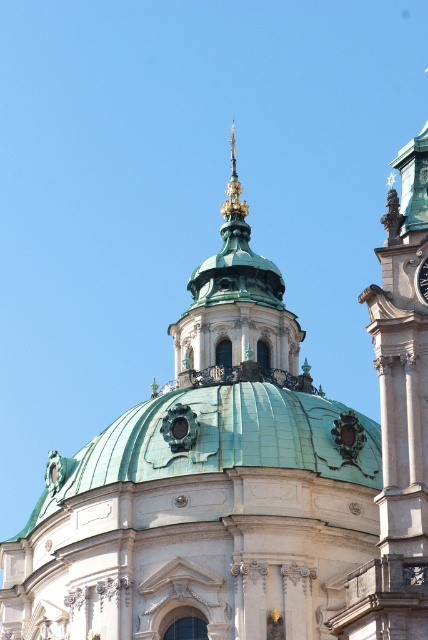
You are an architect examining the dome of this grand structure. You notice two points marked on the dome surface at coordinates point (77, 493) and point (422, 260). Which of these points is closer to you as you stand facing the dome?

Point (77, 493) is closer to you than point (422, 260) because it is further to the viewer.

You are an architect designing a scale model of this structure. The metallic silver clock at upper center must be placed on the model. Given that the green copper dome at center is wider than the clock, where should the clock be positioned relative to the dome to maintain proportional accuracy?

The metallic silver clock at upper center should be positioned above the green copper dome at center since the dome is wider than the clock, allowing the clock to be placed proportionally in a higher position while maintaining scale.

You are standing at the base of the grand structure and looking up at the dome. There is a point marked at coordinates (219,440). Which object does this point lie on?

The point marked at coordinates (219,440) lies on the green copper dome at center.